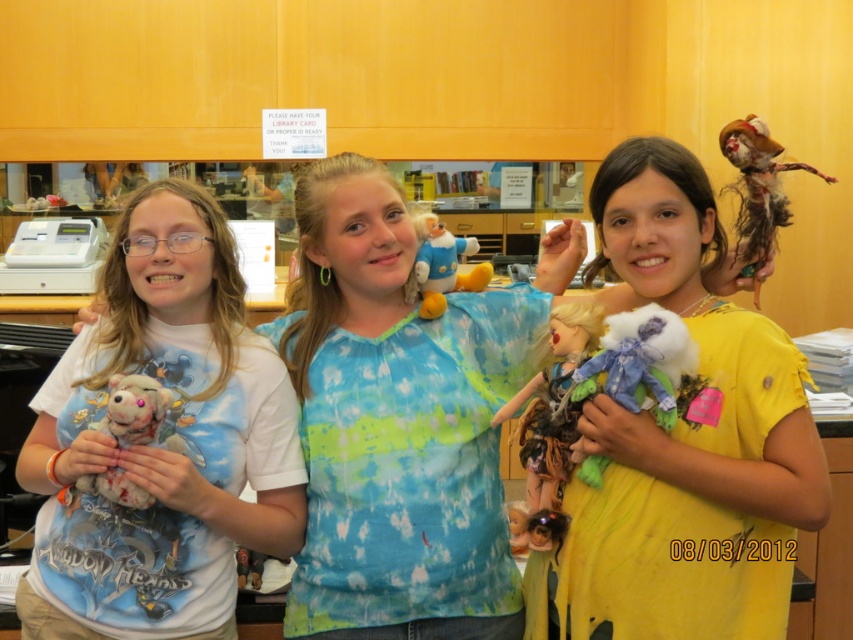
Is fluffy fabric stuffed animal at center smaller than fluffy plush toy at center?

No.

Which is more to the right, fluffy fabric stuffed animal at center or fluffy plush toy at center?

fluffy fabric stuffed animal at center

Which is in front, point (648, 336) or point (447, 240)?

Point (648, 336)

At what (x,y) coordinates should I click in order to perform the action: click on fluffy fabric stuffed animal at center. Please return your answer as a coordinate pair (x, y). The width and height of the screenshot is (853, 640). Looking at the image, I should click on (637, 364).

Can you confirm if tie-dye fabric doll at center is taller than yellow cotton doll at center?

Yes.

Which of these two, tie-dye fabric doll at center or yellow cotton doll at center, stands shorter?

Standing shorter between the two is yellow cotton doll at center.

Which is in front, point (309, 464) or point (628, 579)?

Point (628, 579)

At what (x,y) coordinates should I click in order to perform the action: click on tie-dye fabric doll at center. Please return your answer as a coordinate pair (x, y). Image resolution: width=853 pixels, height=640 pixels. Looking at the image, I should click on (396, 424).

Is tie-dye fabric doll at center taller than fluffy white teddy bear at left?

Indeed, tie-dye fabric doll at center has a greater height compared to fluffy white teddy bear at left.

Between tie-dye fabric doll at center and fluffy white teddy bear at left, which one is positioned lower?

fluffy white teddy bear at left is lower down.

Where is `tie-dye fabric doll at center`? tie-dye fabric doll at center is located at coordinates (396, 424).